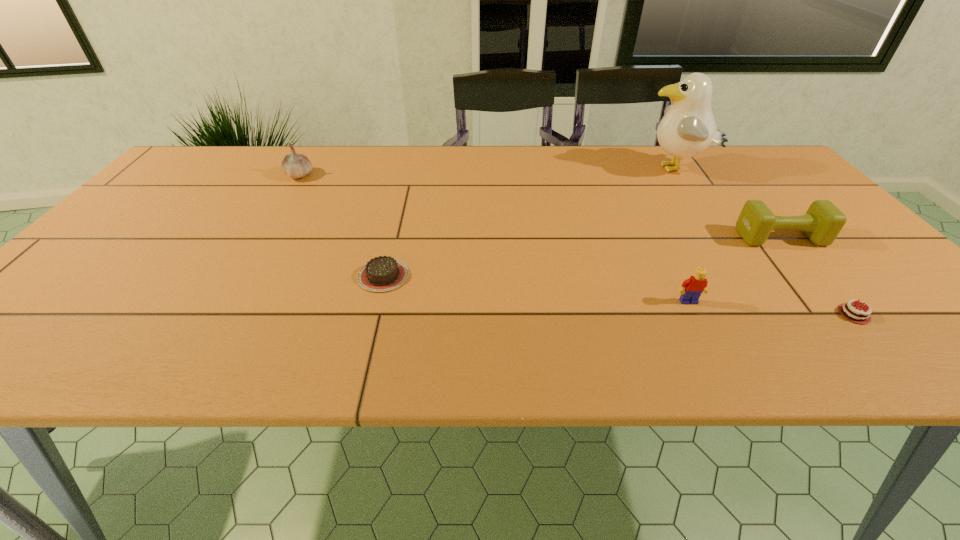
At what (x,y) coordinates should I click in order to perform the action: click on free location located 0.090m on the face of the Lego. Please return your answer as a coordinate pair (x, y). This screenshot has width=960, height=540. Looking at the image, I should click on (708, 340).

Find the location of a particular element. Image resolution: width=960 pixels, height=540 pixels. free space located 0.330m on the back of the dumbbell is located at coordinates (719, 164).

Identify the location of free spot located on the front of the left chocolate cake. This screenshot has width=960, height=540. (373, 314).

Image resolution: width=960 pixels, height=540 pixels. What are the coordinates of `vacant area situated 0.140m on the back of the right chocolate cake` in the screenshot? It's located at (800, 251).

This screenshot has height=540, width=960. I want to click on gull located at the far edge, so click(688, 128).

At what (x,y) coordinates should I click in order to perform the action: click on garlic that is at the far edge. Please return your answer as a coordinate pair (x, y). The height and width of the screenshot is (540, 960). Looking at the image, I should click on (296, 166).

The width and height of the screenshot is (960, 540). What are the coordinates of `object present at the near edge` in the screenshot? It's located at (849, 311).

Where is `dumbbell at the right edge`? The height and width of the screenshot is (540, 960). dumbbell at the right edge is located at coordinates (823, 221).

Locate an element on the screen. Image resolution: width=960 pixels, height=540 pixels. chocolate cake located at the right edge is located at coordinates (849, 311).

This screenshot has width=960, height=540. I want to click on object that is at the near right corner, so click(x=849, y=311).